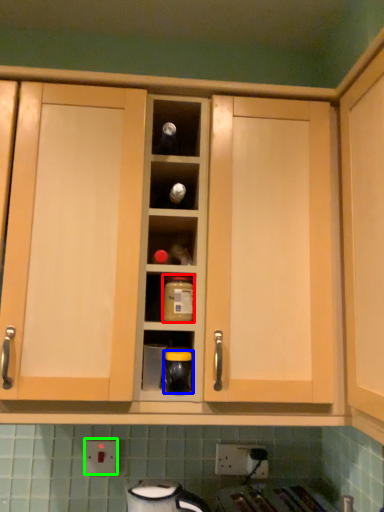
Question: Based on their relative distances, which object is farther from bottle (highlighted by a red box)? Choose from appliance (highlighted by a blue box) and electric outlet (highlighted by a green box).

Choices:
 (A) appliance
 (B) electric outlet

Answer: (B)